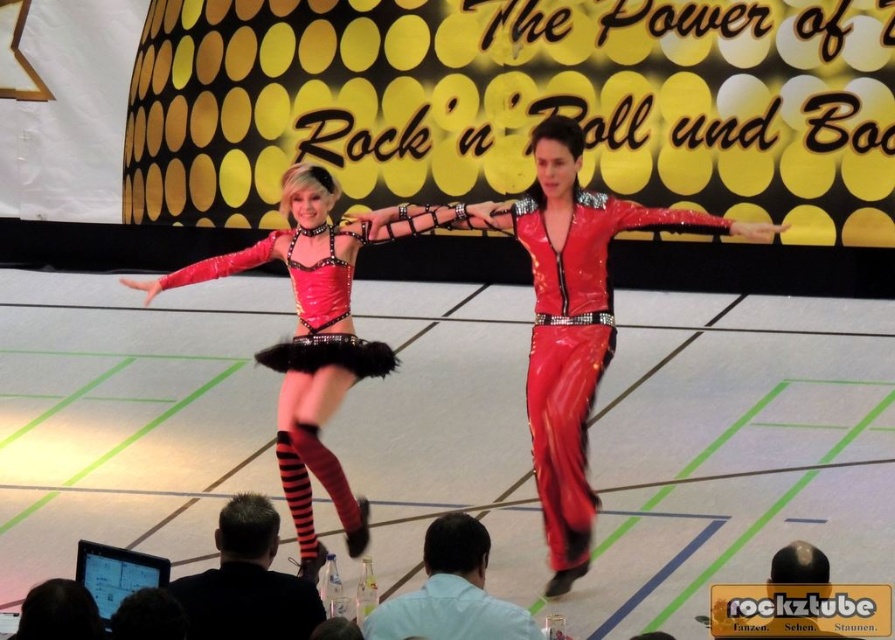
You are a photographer setting up equipment in the backstage area. You notice the light blue shirt at lower center and the black laptop at lower left. Which object is positioned to the right side from your viewpoint?

The light blue shirt at lower center is positioned to the right of the black laptop at lower left according to the description.

You are a photographer positioned at the front of the stage. You want to take a photo that includes both the black leather jacket at lower center and the light blue shirt at lower center. Which one will appear larger in the photo?

The black leather jacket at lower center will appear larger in the photo because it is closer to the viewer than the light blue shirt at lower center.

You are a photographer adjusting your camera to capture the dance performance. You notice two points on the stage marked at coordinates point (232, 618) and point (363, 634). Which point should you focus on first to ensure both are in clear view?

Point (232, 618) is closer to the camera than point (363, 634), so you should focus on point (232, 618) first to ensure both are in clear view.